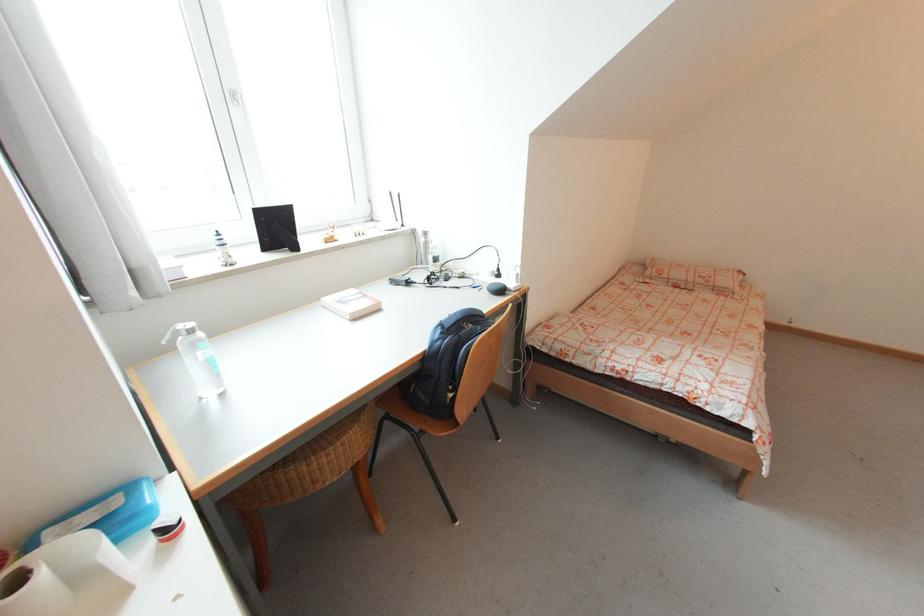
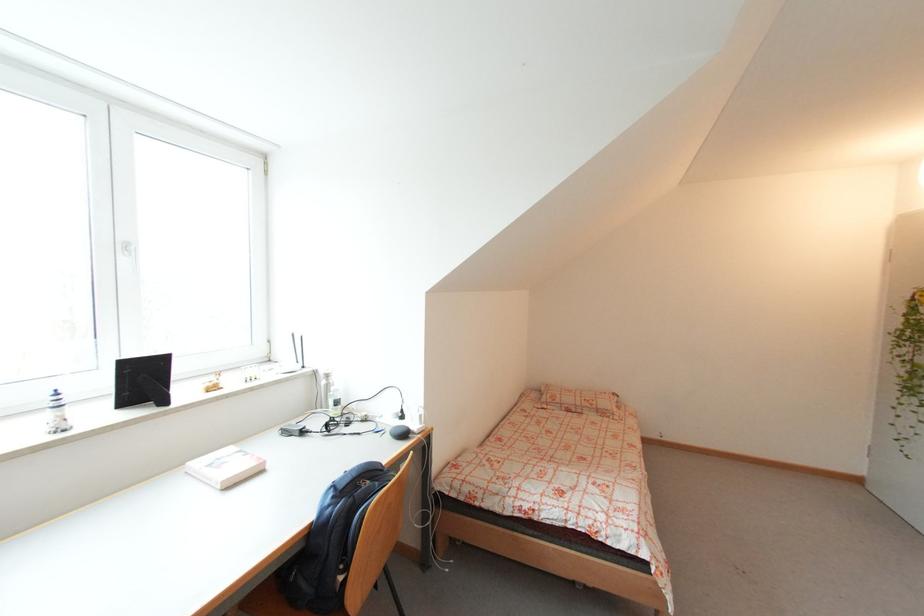
Which direction would the cameraman need to move to produce the second image?

The movement direction of the cameraman is right, backward.